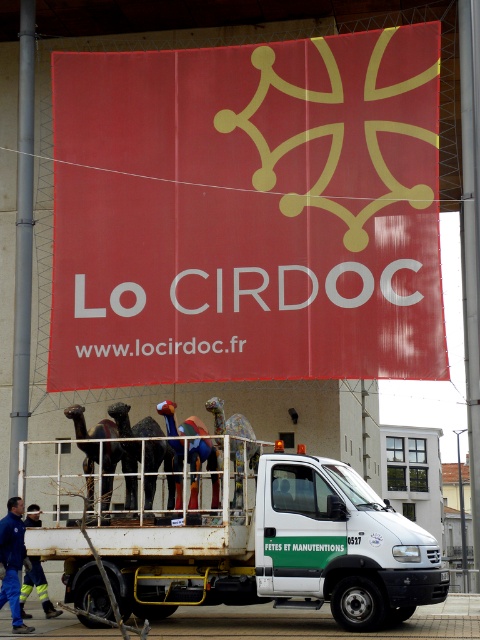
Question: Which point is farther to the camera?

Choices:
 (A) coord(255,74)
 (B) coord(36,566)
 (C) coord(3,536)
 (D) coord(294,500)

Answer: (A)

Question: Is red matte sign at upper center further to camera compared to blue fabric man at lower left?

Choices:
 (A) no
 (B) yes

Answer: (B)

Question: Which of the following is the farthest from the observer?

Choices:
 (A) red matte sign at upper center
 (B) blue fabric man at lower left
 (C) white matte truck at center
 (D) yellow reflective safety vest at lower left

Answer: (A)

Question: Estimate the real-world distances between objects in this image. Which object is farther from the blue fabric man at lower left?

Choices:
 (A) red matte sign at upper center
 (B) white matte truck at center

Answer: (A)

Question: Does red matte sign at upper center have a larger size compared to blue fabric man at lower left?

Choices:
 (A) yes
 (B) no

Answer: (A)

Question: Is white matte truck at center thinner than yellow reflective safety vest at lower left?

Choices:
 (A) yes
 (B) no

Answer: (B)